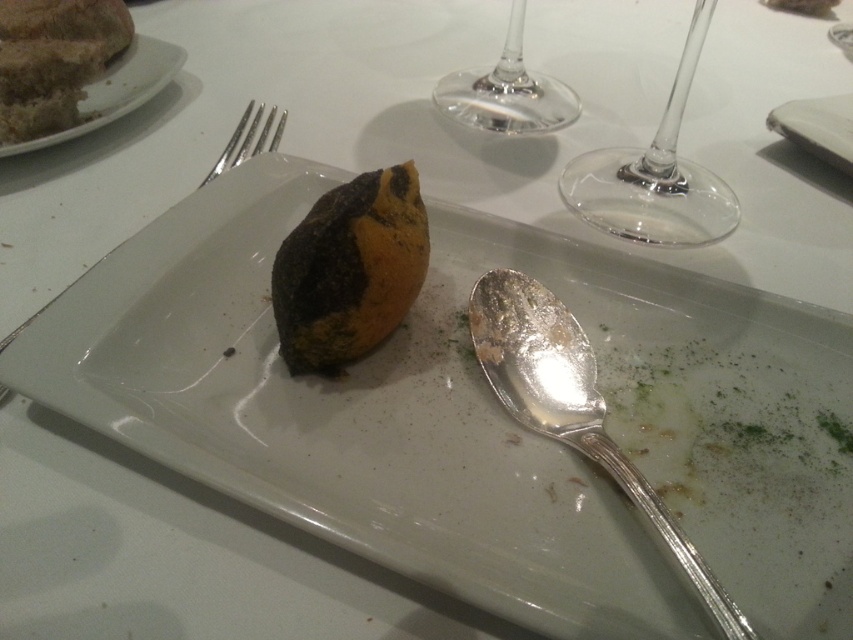
Is point (96, 80) farther from camera compared to point (796, 113)?

No, it is not.

This screenshot has height=640, width=853. Identify the location of brown matte bread at upper left. [x=115, y=90].

This screenshot has width=853, height=640. Describe the element at coordinates (654, 176) in the screenshot. I see `transparent glass wine glass at upper right` at that location.

Where is `transparent glass wine glass at upper right`? The height and width of the screenshot is (640, 853). transparent glass wine glass at upper right is located at coordinates (654, 176).

Is transparent glass wine glass at upper right smaller than white matte plate at upper right?

No, transparent glass wine glass at upper right is not smaller than white matte plate at upper right.

Is transparent glass wine glass at upper right wider than white matte plate at upper right?

Indeed, transparent glass wine glass at upper right has a greater width compared to white matte plate at upper right.

Does point (685, 220) come in front of point (843, 152)?

Yes, it is in front of point (843, 152).

The width and height of the screenshot is (853, 640). What are the coordinates of `transparent glass wine glass at upper right` in the screenshot? It's located at (654, 176).